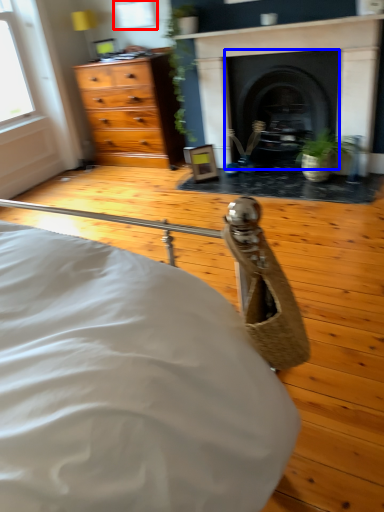
Question: Which object is closer to the camera taking this photo, window (highlighted by a red box) or fireplace (highlighted by a blue box)?

Choices:
 (A) window
 (B) fireplace

Answer: (B)